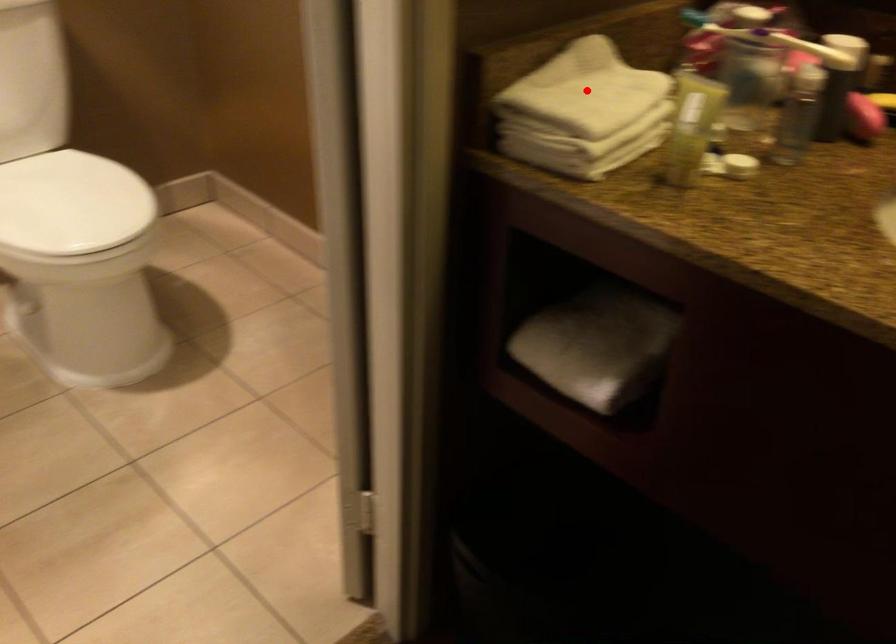
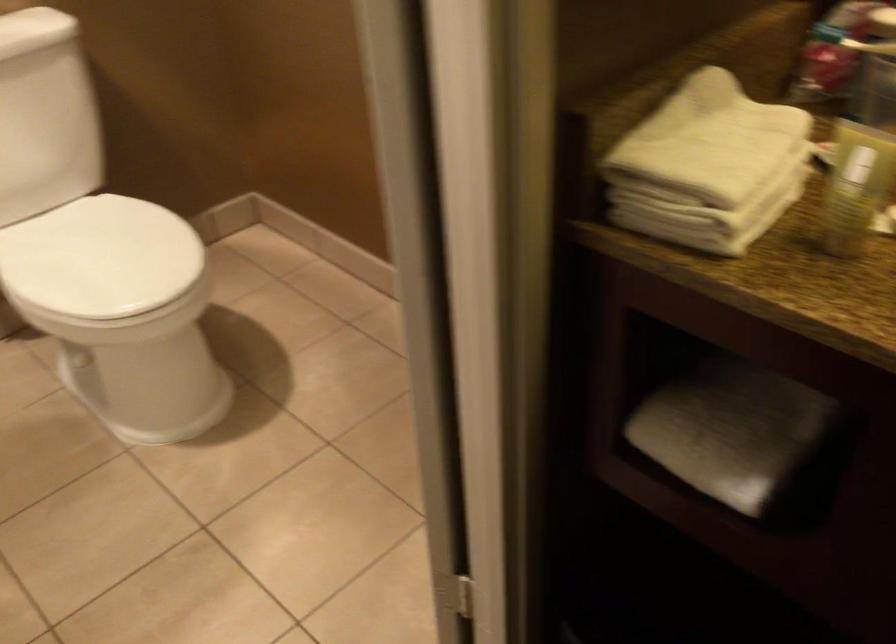
Question: I am providing you with two images of the same scene from different viewpoints. A red point is shown in image1. For the corresponding object point in image2, is it positioned nearer or farther from the camera?

Choices:
 (A) Nearer
 (B) Farther

Answer: (A)